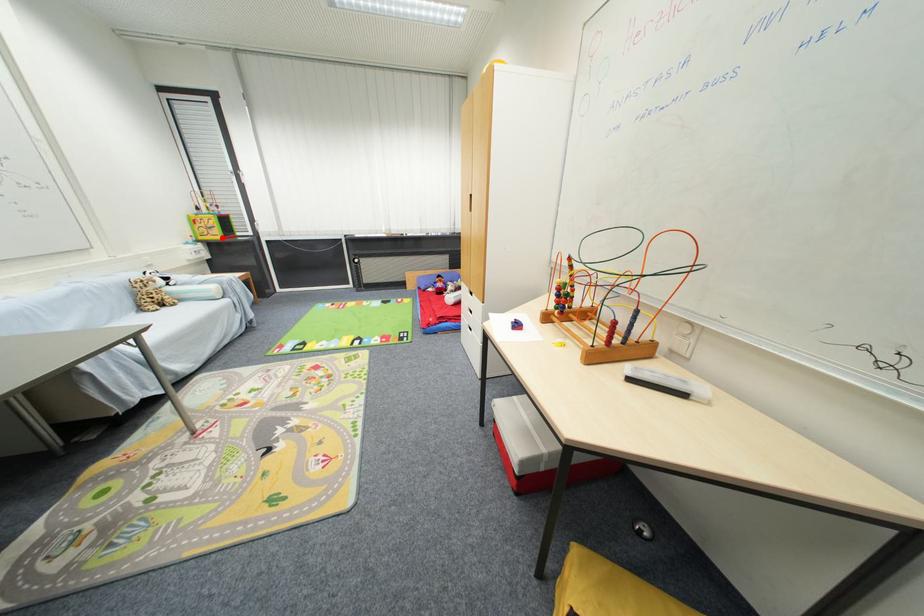
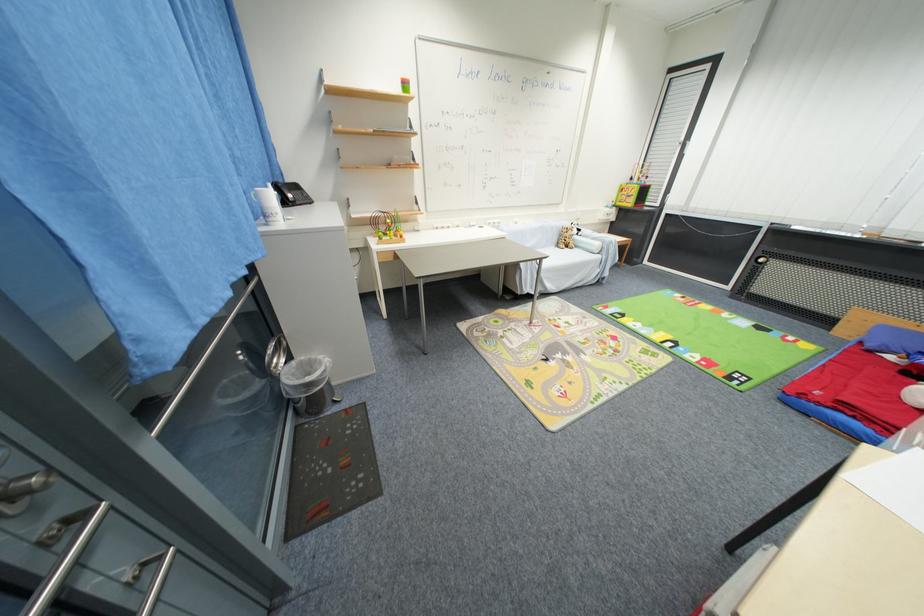
Question: I am providing you with two images of the same scene from different viewpoints. A red point is shown in image1. For the corresponding object point in image2, is it positioned nearer or farther from the camera?

Choices:
 (A) Nearer
 (B) Farther

Answer: (A)